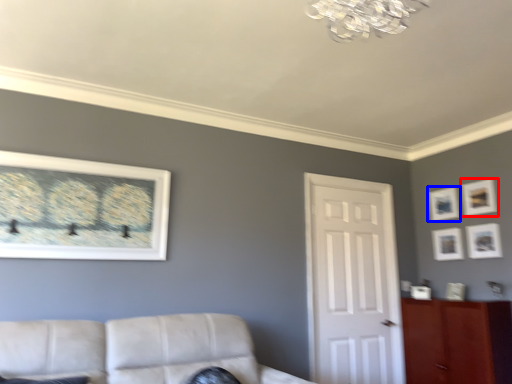
Question: Which of the following is the farthest to the observer, picture frame (highlighted by a red box) or picture frame (highlighted by a blue box)?

Choices:
 (A) picture frame
 (B) picture frame

Answer: (B)